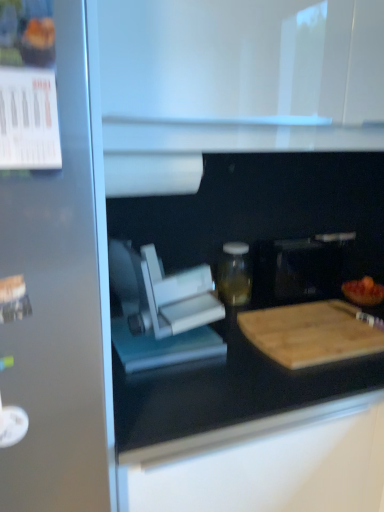
Question: Can we say transparent glass jar at center lies outside white matte paper towel at upper center?

Choices:
 (A) no
 (B) yes

Answer: (B)

Question: Considering the relative sizes of transparent glass jar at center and white matte paper towel at upper center in the image provided, is transparent glass jar at center taller than white matte paper towel at upper center?

Choices:
 (A) yes
 (B) no

Answer: (A)

Question: Considering the relative positions of transparent glass jar at center and white matte paper towel at upper center in the image provided, is transparent glass jar at center to the left of white matte paper towel at upper center from the viewer's perspective?

Choices:
 (A) yes
 (B) no

Answer: (B)

Question: Is transparent glass jar at center aimed at white matte paper towel at upper center?

Choices:
 (A) no
 (B) yes

Answer: (A)

Question: Does transparent glass jar at center have a greater width compared to white matte paper towel at upper center?

Choices:
 (A) yes
 (B) no

Answer: (B)

Question: From the image's perspective, is transparent glass jar at center beneath white matte paper towel at upper center?

Choices:
 (A) no
 (B) yes

Answer: (B)

Question: Does wooden cutting board at lower right have a smaller size compared to wooden cutting board at right?

Choices:
 (A) no
 (B) yes

Answer: (A)

Question: From a real-world perspective, is wooden cutting board at lower right positioned under wooden cutting board at right based on gravity?

Choices:
 (A) no
 (B) yes

Answer: (B)

Question: Is wooden cutting board at right a part of wooden cutting board at lower right?

Choices:
 (A) no
 (B) yes

Answer: (A)

Question: Is wooden cutting board at lower right to the left of wooden cutting board at right from the viewer's perspective?

Choices:
 (A) yes
 (B) no

Answer: (A)

Question: Can you confirm if wooden cutting board at lower right is thinner than wooden cutting board at right?

Choices:
 (A) yes
 (B) no

Answer: (B)

Question: From the image's perspective, does wooden cutting board at lower right appear higher than wooden cutting board at right?

Choices:
 (A) yes
 (B) no

Answer: (B)

Question: Is wooden cutting board at lower right inside transparent glass jar at center?

Choices:
 (A) no
 (B) yes

Answer: (A)